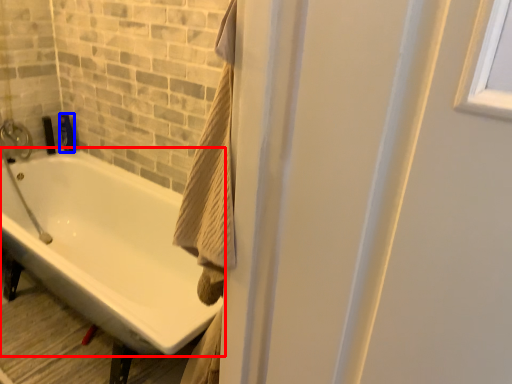
Question: Which point is closer to the camera, bathtub (highlighted by a red box) or toiletry (highlighted by a blue box)?

Choices:
 (A) bathtub
 (B) toiletry

Answer: (A)